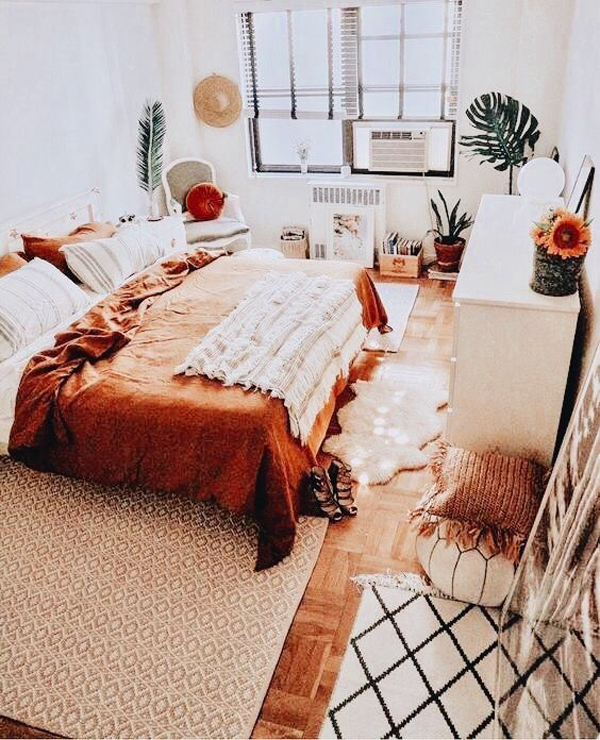
Where is `grey rug`? This screenshot has height=740, width=600. grey rug is located at coordinates (198, 602).